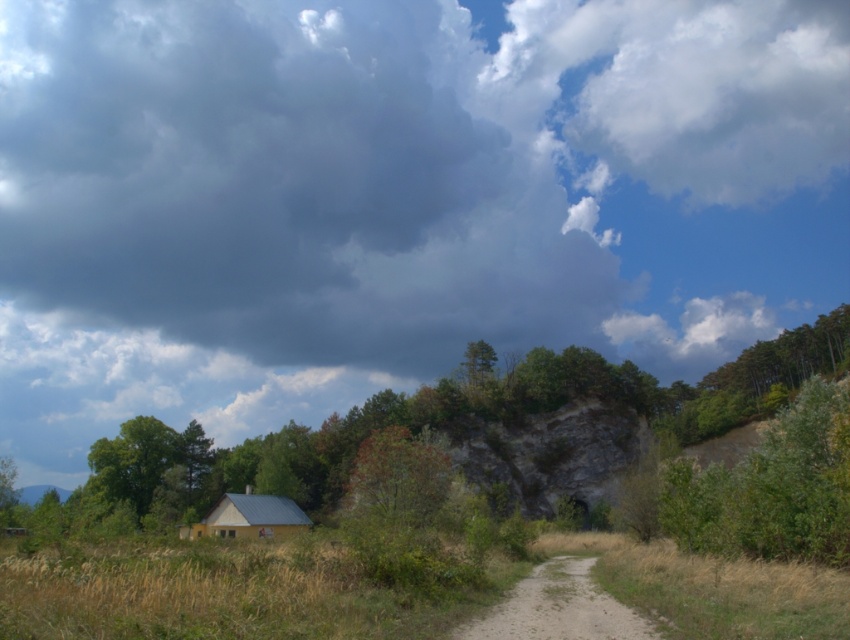
You are standing at the edge of the dirt path in the rural landscape. You notice the green matte tree at lower left and the yellow matte hut at lower center. Which object is positioned higher in the image?

The green matte tree at lower left is above the yellow matte hut at lower center, so it is positioned higher in the image.